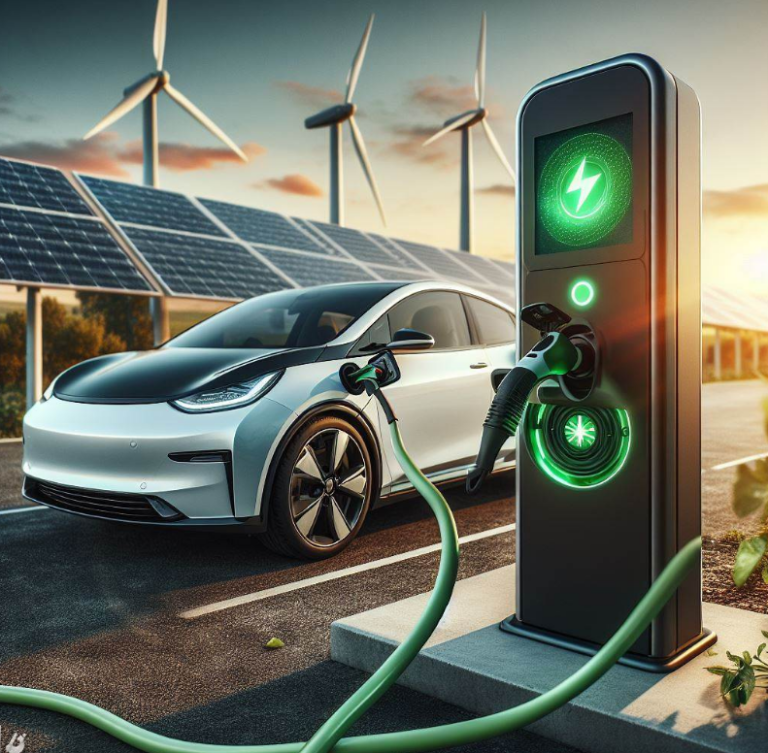
Where is `hood`? The width and height of the screenshot is (768, 753). hood is located at coordinates point(190,367).